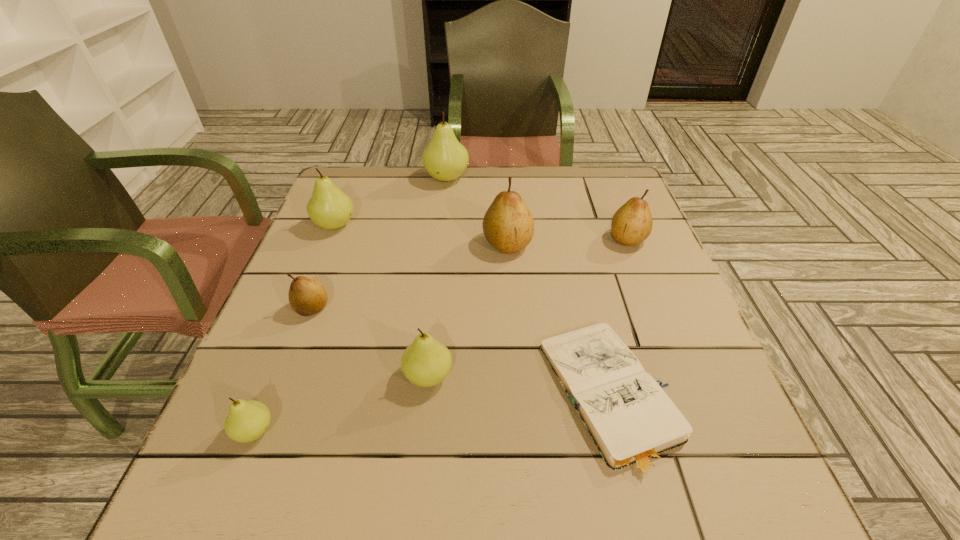
Find the location of a particular element. vacant space at the right edge is located at coordinates (x=639, y=312).

The height and width of the screenshot is (540, 960). In order to click on free space between the second biggest green pear and the leftmost brown pear in this screenshot , I will do `click(324, 267)`.

You are a GUI agent. You are given a task and a screenshot of the screen. Output one action in this format:
    pyautogui.click(x=<x>, y=<y>)
    Task: Click on the empty space between the fifth farthest pear and the biggest brown pear
    
    Given the screenshot: What is the action you would take?
    pyautogui.click(x=410, y=276)

Locate an element on the screen. free space between the rightmost brown pear and the third nearest green pear is located at coordinates (481, 232).

This screenshot has width=960, height=540. In order to click on vacant area that lies between the biggest brown pear and the third nearest pear in this screenshot , I will do `click(410, 276)`.

Locate an element on the screen. Image resolution: width=960 pixels, height=540 pixels. free spot between the second farthest green pear and the leftmost brown pear is located at coordinates (324, 267).

You are a GUI agent. You are given a task and a screenshot of the screen. Output one action in this format:
    pyautogui.click(x=<x>, y=<y>)
    Task: Click on the empty location between the fourth nearest object and the farthest green pear
    Image resolution: width=960 pixels, height=540 pixels.
    Given the screenshot: What is the action you would take?
    pyautogui.click(x=379, y=243)

This screenshot has width=960, height=540. Identify the location of vacant space in between the sixth farthest pear and the biggest green pear. (438, 277).

Where is `empty space between the nearest pear and the rightmost brown pear`? empty space between the nearest pear and the rightmost brown pear is located at coordinates (441, 335).

The width and height of the screenshot is (960, 540). Find the location of `vacant region between the second smallest green pear and the biggest green pear`. vacant region between the second smallest green pear and the biggest green pear is located at coordinates (438, 277).